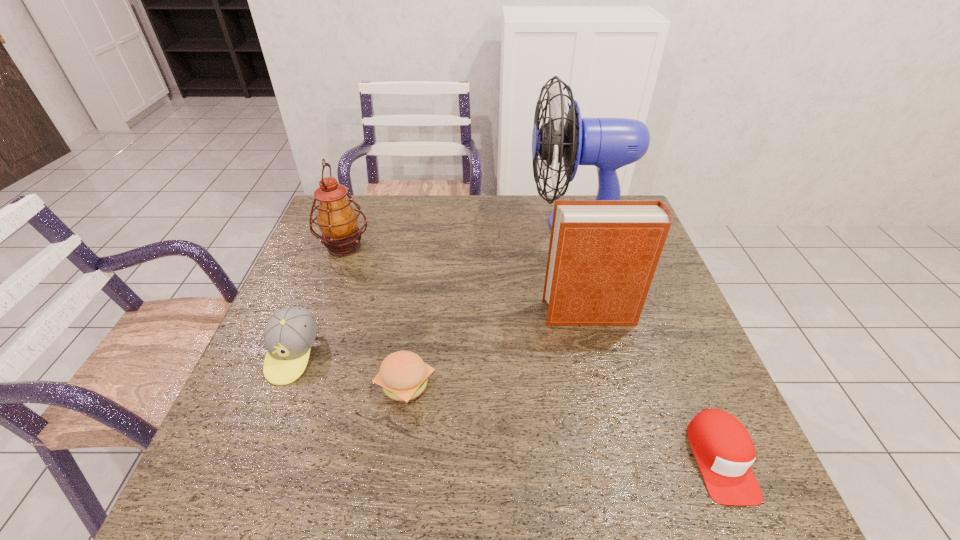
At what (x,y) coordinates should I click in order to perform the action: click on blank space at the left edge of the desktop. Please return your answer as a coordinate pair (x, y). Image resolution: width=960 pixels, height=540 pixels. Looking at the image, I should click on (323, 350).

Find the location of `vacant space at the right edge of the desktop`. vacant space at the right edge of the desktop is located at coordinates (641, 347).

Identify the location of blank area at the near left corner. (256, 466).

What are the coordinates of `free space between the nearest object and the hardback book` in the screenshot? It's located at (655, 386).

Where is `blank region between the hardback book and the oil lamp`? blank region between the hardback book and the oil lamp is located at coordinates (468, 280).

Locate an element on the screen. The image size is (960, 540). vacant space that is in between the hardback book and the oil lamp is located at coordinates (468, 280).

I want to click on free spot between the fourth object from right to left and the oil lamp, so click(374, 315).

Find the location of a particular element. This screenshot has height=540, width=960. vacant area that lies between the nearest object and the oil lamp is located at coordinates (532, 353).

At what (x,y) coordinates should I click in order to perform the action: click on free space that is in between the fourth object from right to left and the right baseball cap. Please return your answer as a coordinate pair (x, y). This screenshot has height=540, width=960. Looking at the image, I should click on (563, 422).

Where is `vacant point located between the tallest object and the third object from left to right`? This screenshot has height=540, width=960. vacant point located between the tallest object and the third object from left to right is located at coordinates (492, 304).